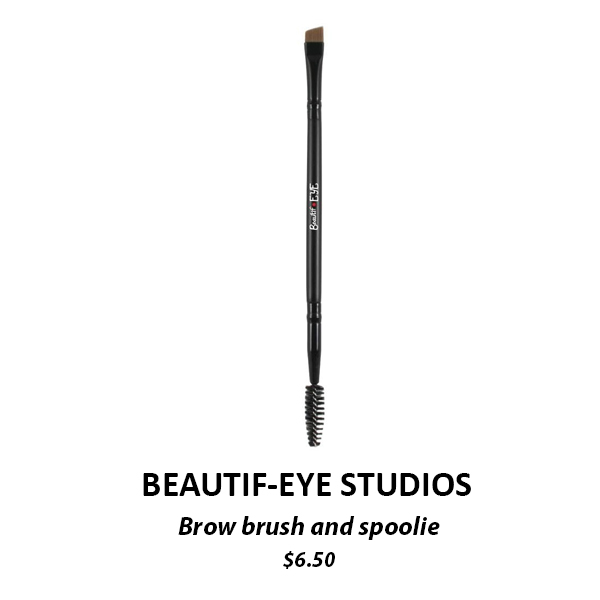
Identify the location of studios. (390, 492).